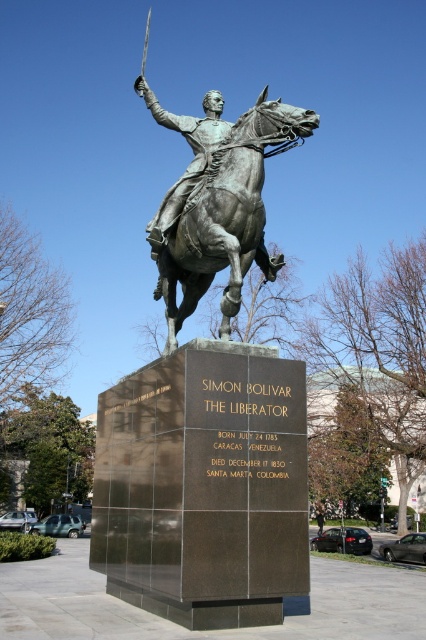
Based on the scene description, what are the coordinates of the bronze statue at center?

The bronze statue at center is located at coordinates (210,422).